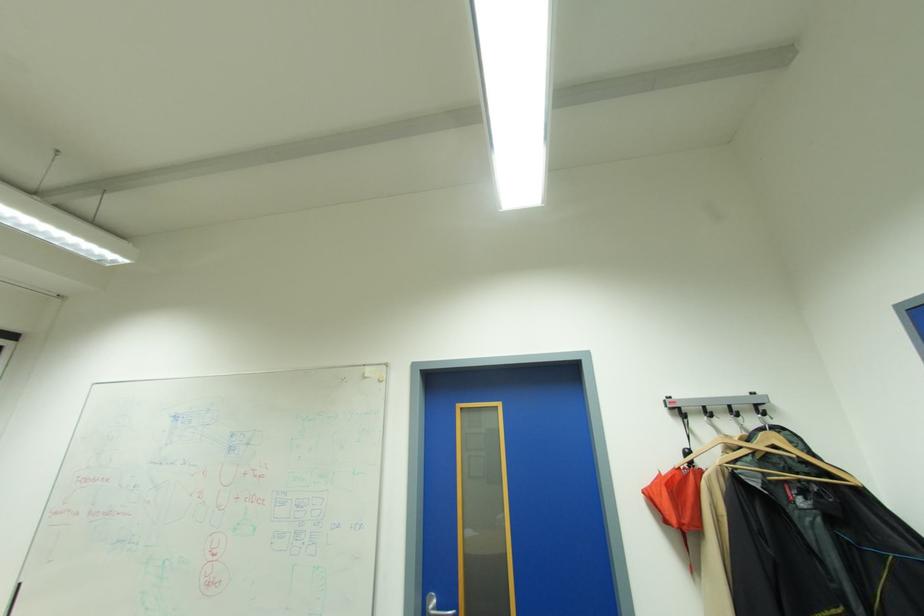
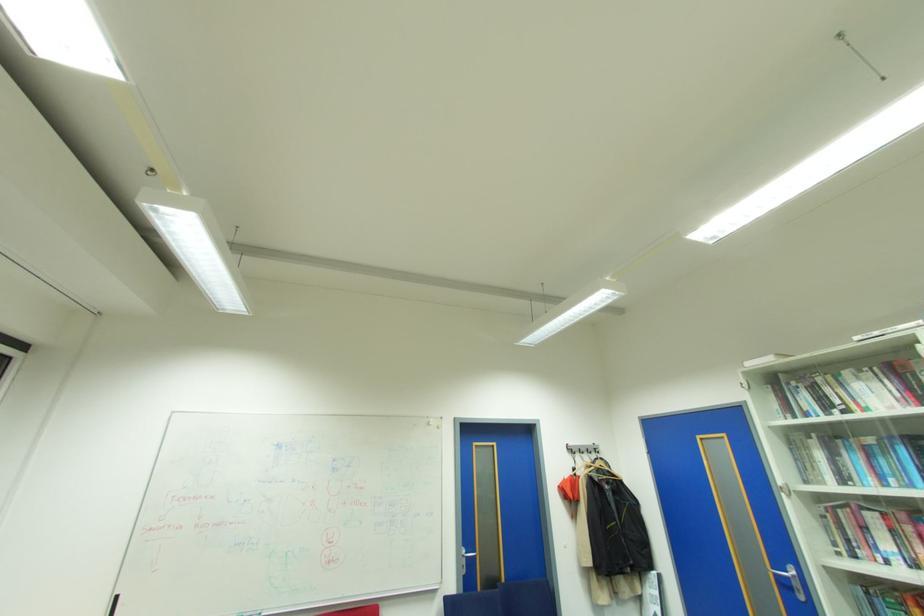
In the second image, find the point that corresponds to the point at 760,406 in the first image.

(600, 448)